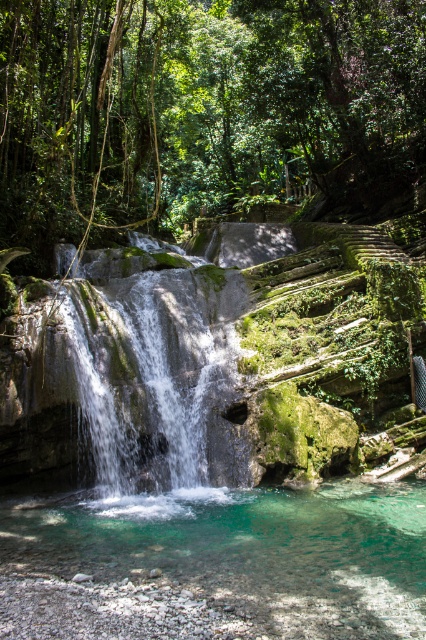
You are a hiker who wants to cross the waterfall area. You see the green mossy rocks at center and the clear glass water at center. Which path is wider for walking?

The green mossy rocks at center are wider than the clear glass water at center, so the path over the green mossy rocks at center is wider for walking.

You are standing at the edge of the waterfall pool in the tropical scene. There is a point marked at coordinates (206, 113). What can you see at that point?

At point (206, 113) lies green mossy rocks at center.